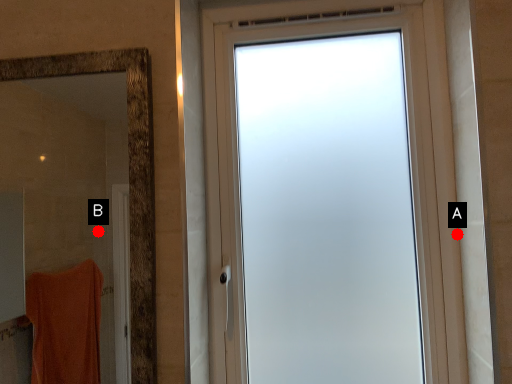
Question: Two points are circled on the image, labeled by A and B beside each circle. Which point is closer to the camera taking this photo?

Choices:
 (A) A is closer
 (B) B is closer

Answer: (A)